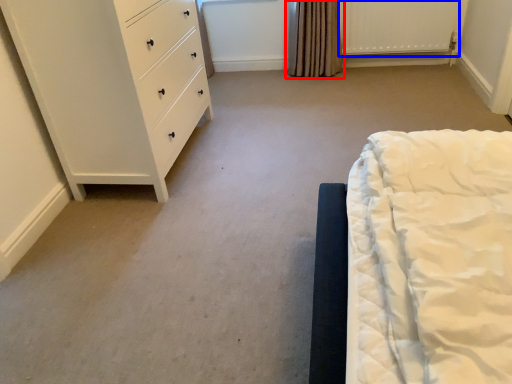
Question: Which of the following is the farthest to the observer, curtain (highlighted by a red box) or radiator (highlighted by a blue box)?

Choices:
 (A) curtain
 (B) radiator

Answer: (A)